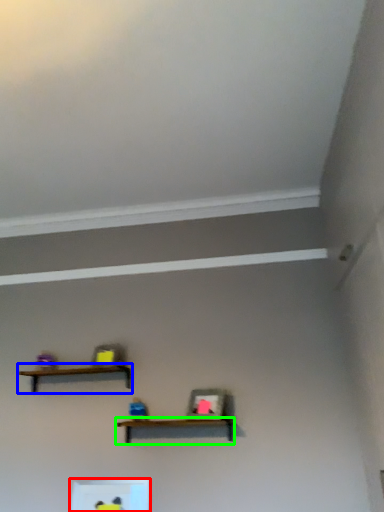
Question: Which is nearer to the shelf (highlighted by a red box)? shelf (highlighted by a blue box) or shelf (highlighted by a green box).

Choices:
 (A) shelf
 (B) shelf

Answer: (B)